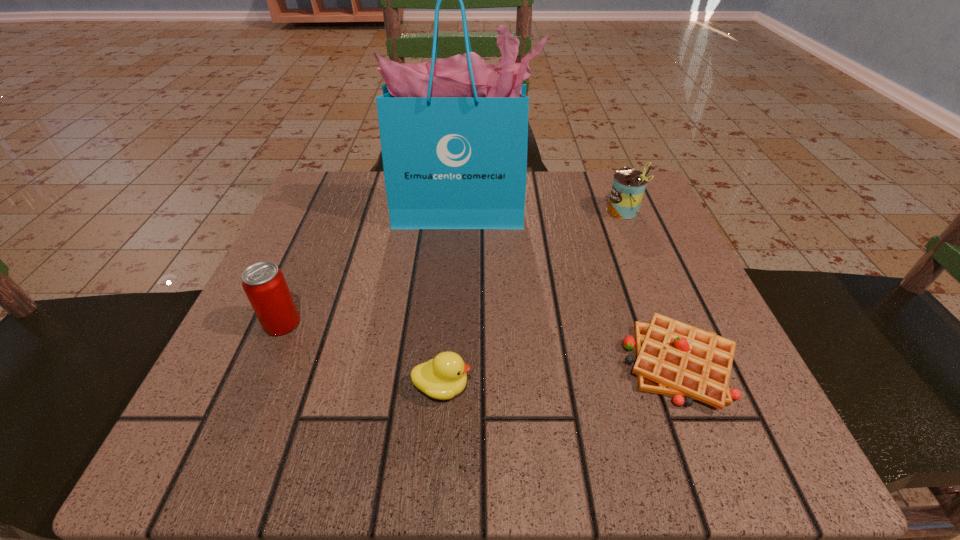
Locate an element on the screen. The width and height of the screenshot is (960, 540). vacant area located on the back of the shortest object is located at coordinates (616, 205).

At what (x,y) coordinates should I click in order to perform the action: click on shopping bag located in the far edge section of the desktop. Please return your answer as a coordinate pair (x, y). Looking at the image, I should click on (454, 132).

This screenshot has width=960, height=540. Find the location of `can present at the far edge`. can present at the far edge is located at coordinates pyautogui.click(x=628, y=187).

At what (x,y) coordinates should I click in order to perform the action: click on duckling positioned at the near edge. Please return your answer as a coordinate pair (x, y). The height and width of the screenshot is (540, 960). Looking at the image, I should click on (443, 377).

What are the coordinates of `waffle located at the near edge` in the screenshot? It's located at click(673, 358).

Identify the location of object present at the left edge. The image size is (960, 540). (264, 284).

Find the location of `can that is positioned at the right edge`. can that is positioned at the right edge is located at coordinates (628, 187).

This screenshot has width=960, height=540. What are the coordinates of `waffle located in the right edge section of the desktop` in the screenshot? It's located at (673, 358).

The height and width of the screenshot is (540, 960). Find the location of `object situated at the far right corner`. object situated at the far right corner is located at coordinates (628, 187).

In order to click on object that is positioned at the near right corner in this screenshot , I will do `click(673, 358)`.